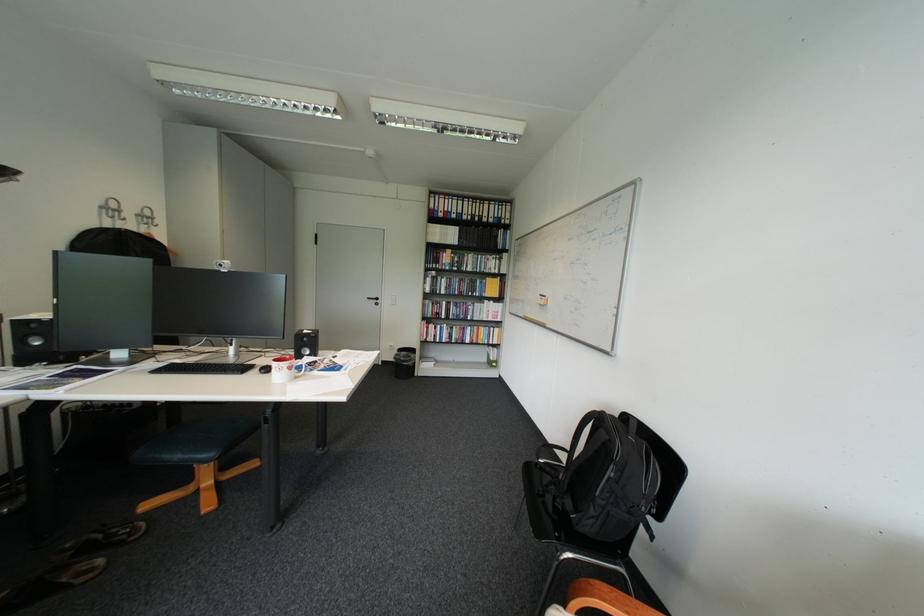
Where would you lift the white and red mug? Please return your answer as a coordinate pair (x, y).

(283, 369)